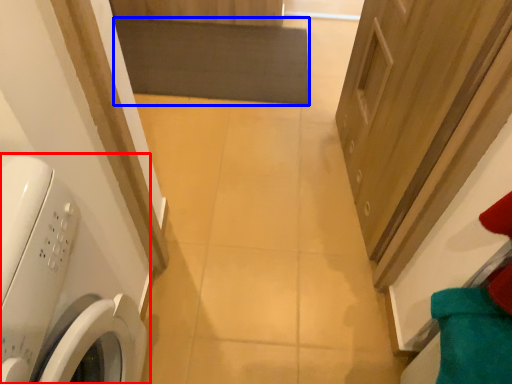
Question: Which of the following is the farthest to the observer, washing machine (highlighted by a red box) or mat (highlighted by a blue box)?

Choices:
 (A) washing machine
 (B) mat

Answer: (B)